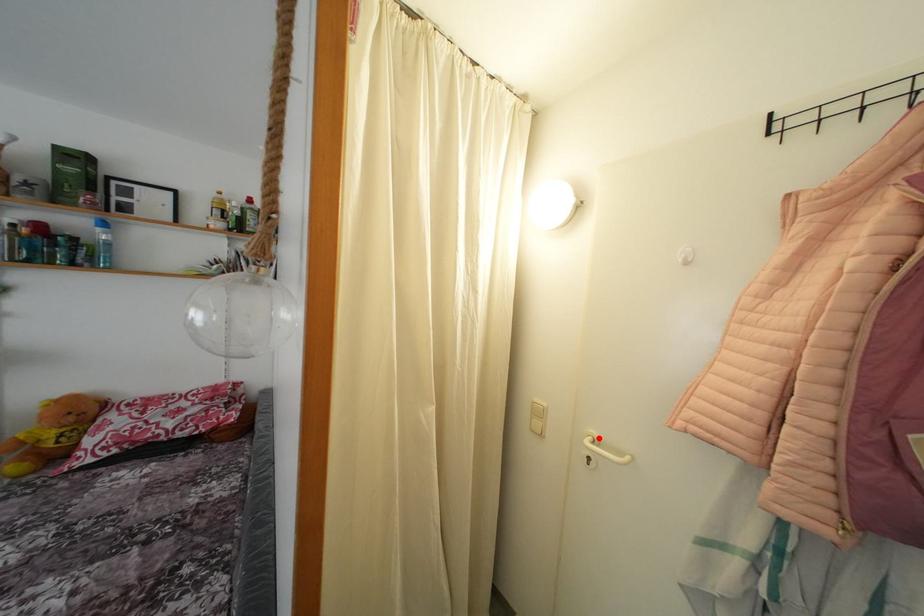
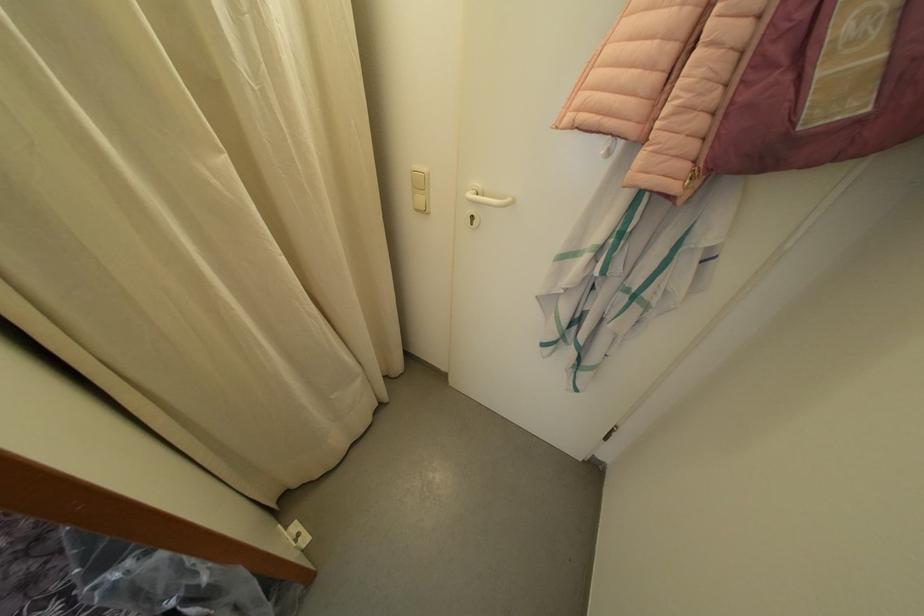
In the second image, find the point that corresponds to the highlighted location in the first image.

(482, 190)